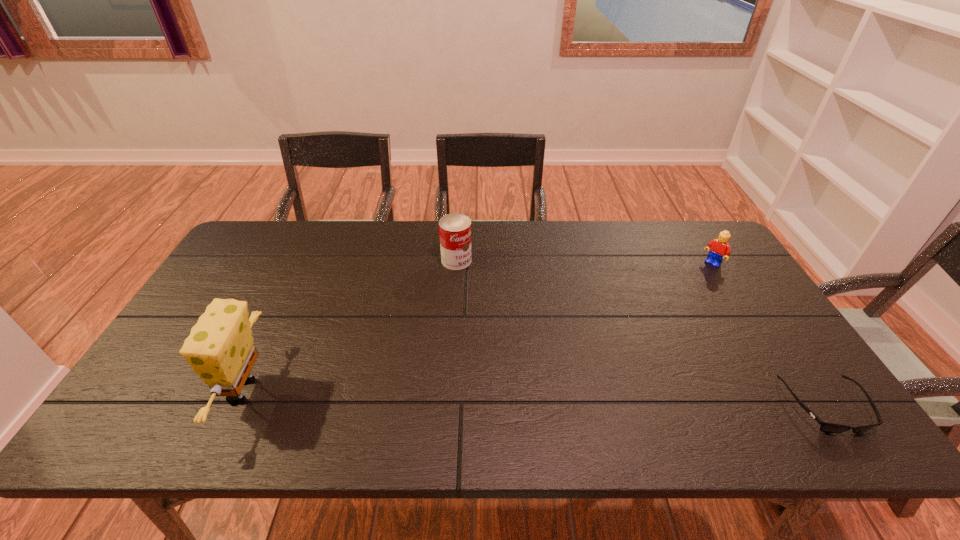
Image resolution: width=960 pixels, height=540 pixels. I want to click on Lego located at the right edge, so click(719, 248).

Find the location of a particular element. The height and width of the screenshot is (540, 960). object at the far right corner is located at coordinates (719, 248).

Locate an element on the screen. The width and height of the screenshot is (960, 540). object that is at the near right corner is located at coordinates 825,427.

Locate an element on the screen. This screenshot has height=540, width=960. vacant space at the far edge is located at coordinates (289, 245).

Where is `free space at the near edge of the desktop`? The image size is (960, 540). free space at the near edge of the desktop is located at coordinates (580, 382).

Where is `free space at the left edge`? free space at the left edge is located at coordinates (244, 277).

You are a GUI agent. You are given a task and a screenshot of the screen. Output one action in this format:
    pyautogui.click(x=<x>, y=<y>)
    Task: Click on the free space at the right edge of the desktop
    
    Given the screenshot: What is the action you would take?
    pyautogui.click(x=712, y=313)

Where is `unoccupied position between the shortest object and the leftmost object`? The width and height of the screenshot is (960, 540). unoccupied position between the shortest object and the leftmost object is located at coordinates (535, 399).

The image size is (960, 540). In order to click on free space between the Lego and the shortest object in this screenshot , I will do `click(769, 335)`.

At what (x,y) coordinates should I click in order to perform the action: click on free space that is in between the second shortest object and the can. Please return your answer as a coordinate pair (x, y). Looking at the image, I should click on (585, 262).